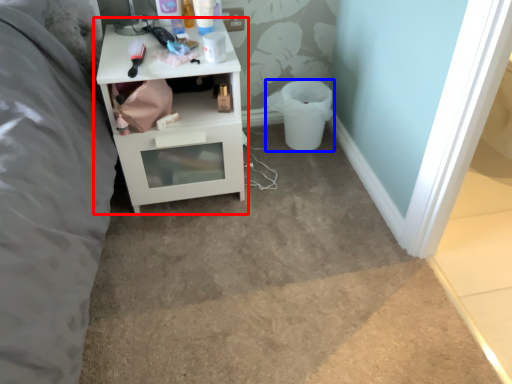
Question: Which point is closer to the camera, nightstand (highlighted by a red box) or toilet bowl (highlighted by a blue box)?

Choices:
 (A) nightstand
 (B) toilet bowl

Answer: (A)